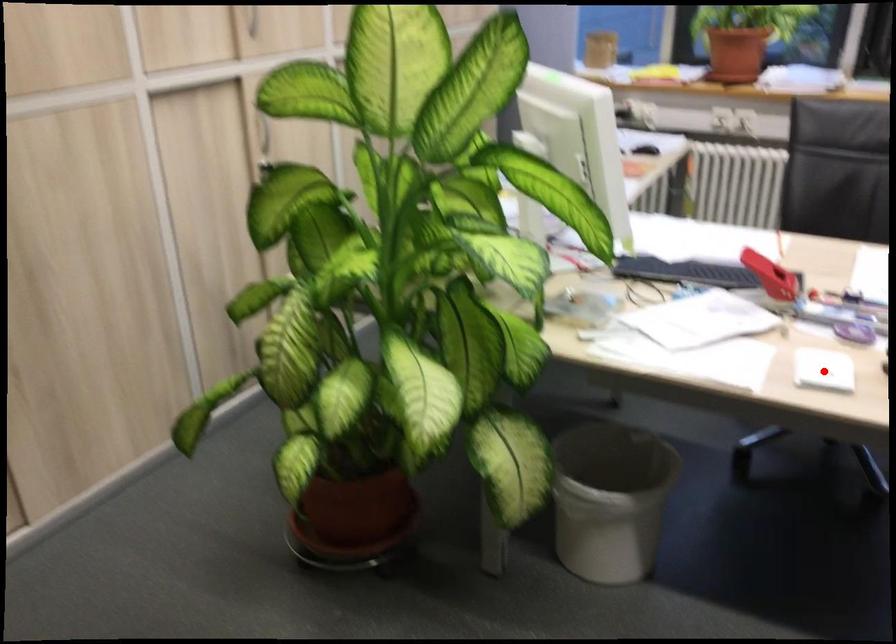
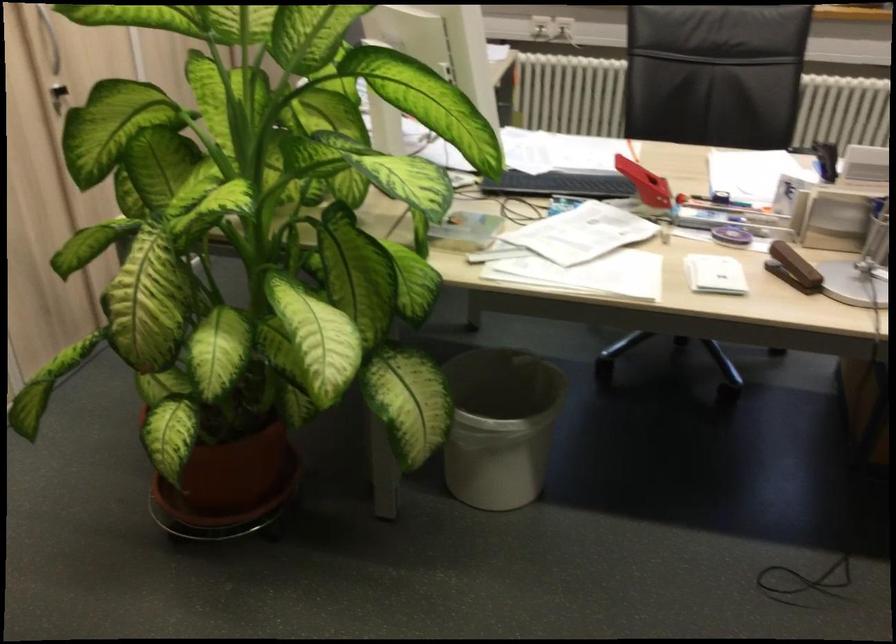
Find the pixel in the second image that matches the highlighted location in the first image.

(714, 274)